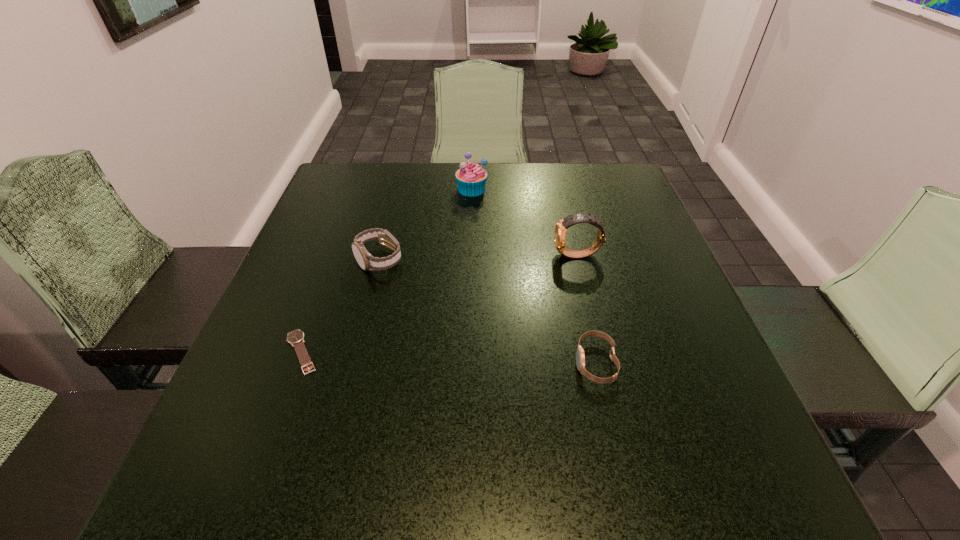
Locate an element on the screen. The width and height of the screenshot is (960, 540). free space between the tallest watch and the second shortest watch is located at coordinates (587, 309).

Where is `free space that is in between the shortest watch and the third tallest watch`? The height and width of the screenshot is (540, 960). free space that is in between the shortest watch and the third tallest watch is located at coordinates (448, 357).

Locate an element on the screen. free space between the second watch from left to right and the shortest object is located at coordinates (341, 306).

Locate which object is the fourth closest to the third tallest watch. Please provide its 2D coordinates. Your answer should be formatted as a tuple, i.e. [(x, y)], where the tuple contains the x and y coordinates of a point satisfying the conditions above.

[(471, 177)]

Identify which object is the closest to the shortest watch. Please provide its 2D coordinates. Your answer should be formatted as a tuple, i.e. [(x, y)], where the tuple contains the x and y coordinates of a point satisfying the conditions above.

[(366, 261)]

Locate an element on the screen. Image resolution: width=960 pixels, height=540 pixels. watch that can be found as the second closest to the second shortest watch is located at coordinates (366, 261).

Where is `watch that is the third closest to the fourth tallest object`? The width and height of the screenshot is (960, 540). watch that is the third closest to the fourth tallest object is located at coordinates (296, 338).